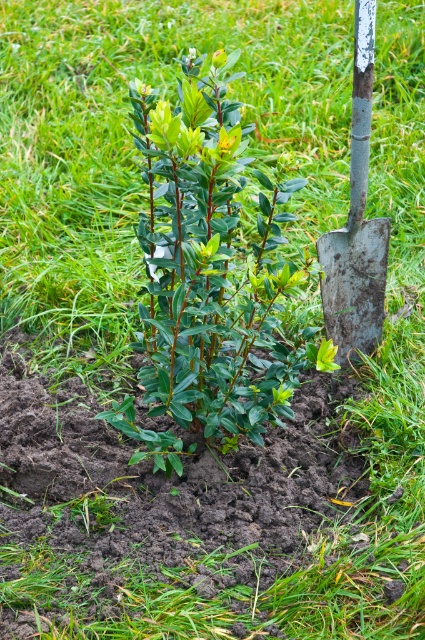
Which is behind, point (274, 403) or point (363, 189)?

The point (363, 189) is more distant.

Does green glossy bush at center appear on the left side of rusty metal shovel at right?

Indeed, green glossy bush at center is positioned on the left side of rusty metal shovel at right.

Does point (201, 349) come closer to viewer compared to point (368, 330)?

Yes.

The height and width of the screenshot is (640, 425). In order to click on green glossy bush at center in this screenshot , I will do `click(210, 266)`.